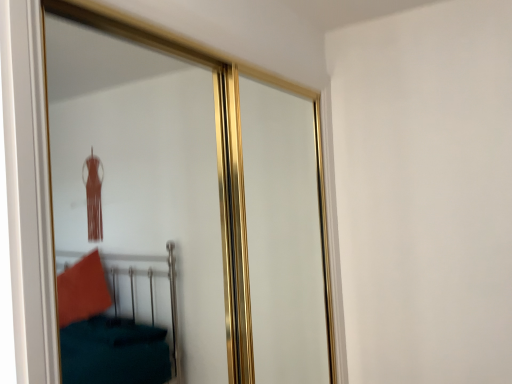
Measure the distance between gold metallic mirror at center and camera.

The depth of gold metallic mirror at center is 6.68 feet.

The width and height of the screenshot is (512, 384). Describe the element at coordinates (140, 195) in the screenshot. I see `gold metallic mirror at center` at that location.

In the scene shown: What is the approximate width of gold metallic mirror at center?

The width of gold metallic mirror at center is 7.10 inches.

Image resolution: width=512 pixels, height=384 pixels. I want to click on gold metallic mirror at center, so click(140, 195).

What are the coordinates of `gold metallic mirror at center` in the screenshot? It's located at (140, 195).